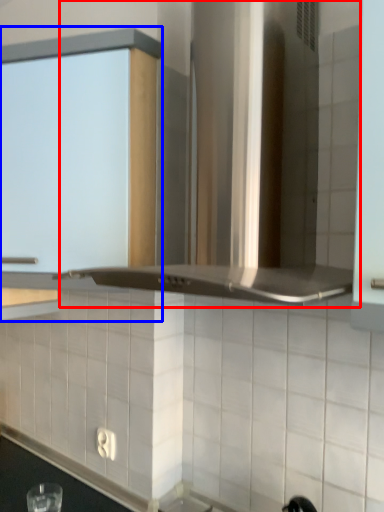
Question: Which object appears farthest to the camera in this image, vent (highlighted by a red box) or cabinetry (highlighted by a blue box)?

Choices:
 (A) vent
 (B) cabinetry

Answer: (B)